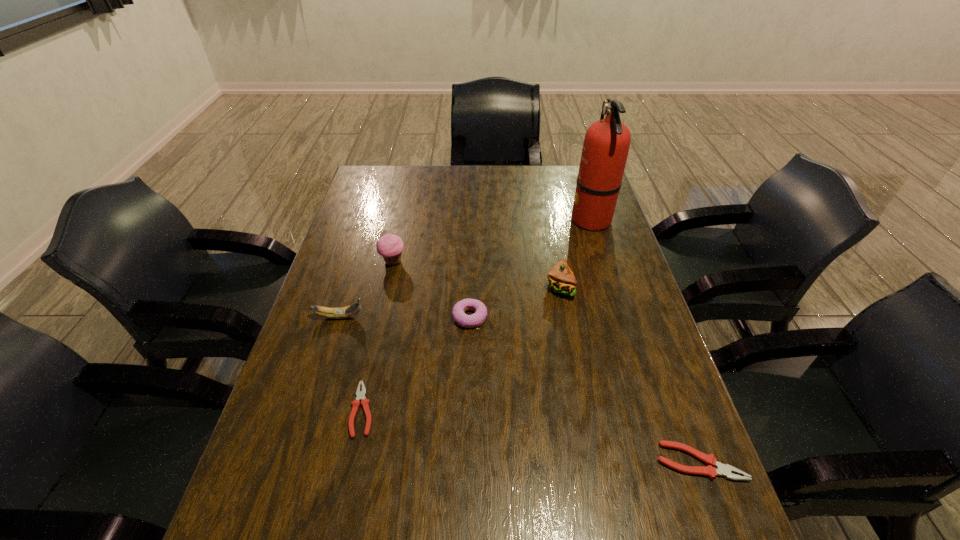
You are a GUI agent. You are given a task and a screenshot of the screen. Output one action in this format:
    pyautogui.click(x=<x>, y=<y>)
    Task: Click on the free spot located on the right of the third shortest object
    The width and height of the screenshot is (960, 540).
    Given the screenshot: What is the action you would take?
    pyautogui.click(x=520, y=317)

Locate an element on the screen. This screenshot has height=540, width=960. free space located on the peel of the fourth tallest object is located at coordinates (418, 317).

I want to click on object situated at the near edge, so click(x=723, y=470).

I want to click on cupcake located at the left edge, so click(390, 246).

Find the location of a particular element. This screenshot has width=960, height=540. banana present at the left edge is located at coordinates (343, 312).

At what (x,y) coordinates should I click in order to perform the action: click on pliers that is at the right edge. Please return your answer as a coordinate pair (x, y). Image resolution: width=960 pixels, height=540 pixels. Looking at the image, I should click on (723, 470).

Identify the location of fire extinguisher that is at the right edge. (606, 145).

Find the location of a particular element. This screenshot has width=960, height=540. object located at the near right corner is located at coordinates 723,470.

In the image, there is a desktop. Identify the location of vacant space at the far edge. (503, 197).

This screenshot has height=540, width=960. In the image, there is a desktop. Identify the location of free space at the near edge. (568, 466).